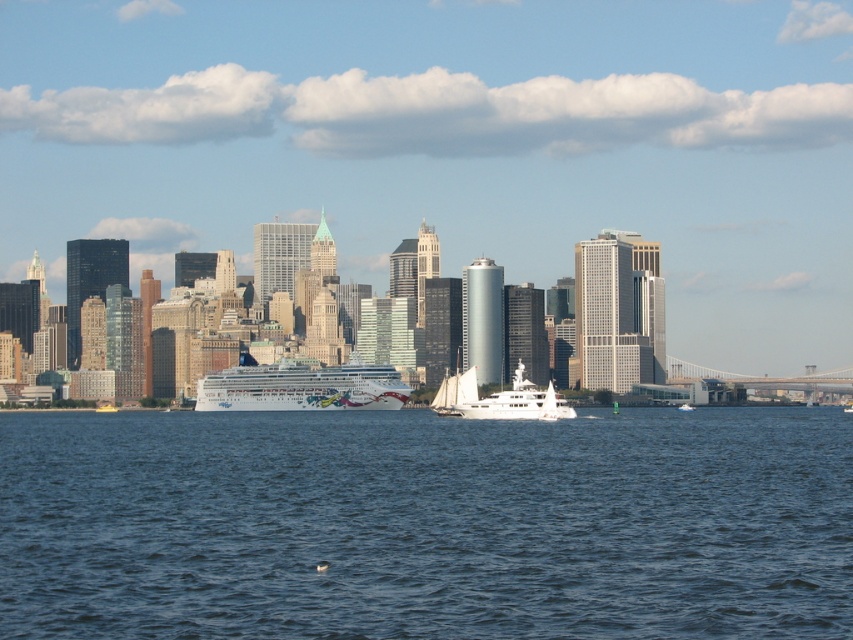
Question: Does blue water at center have a greater width compared to white glossy cruise ship at center?

Choices:
 (A) no
 (B) yes

Answer: (B)

Question: Is blue water at center positioned at the back of white glossy sailboat at center?

Choices:
 (A) no
 (B) yes

Answer: (A)

Question: Which object is farther from the camera taking this photo?

Choices:
 (A) blue water at center
 (B) white glossy sailboat at center
 (C) white glossy cruise ship at center

Answer: (B)

Question: Which object is positioned farthest from the white glossy sailboat at center?

Choices:
 (A) white glossy cruise ship at center
 (B) blue water at center

Answer: (B)

Question: Among these objects, which one is farthest from the camera?

Choices:
 (A) white glossy sailboat at center
 (B) blue water at center

Answer: (A)

Question: Is blue water at center closer to the viewer compared to white glossy cruise ship at center?

Choices:
 (A) yes
 (B) no

Answer: (B)